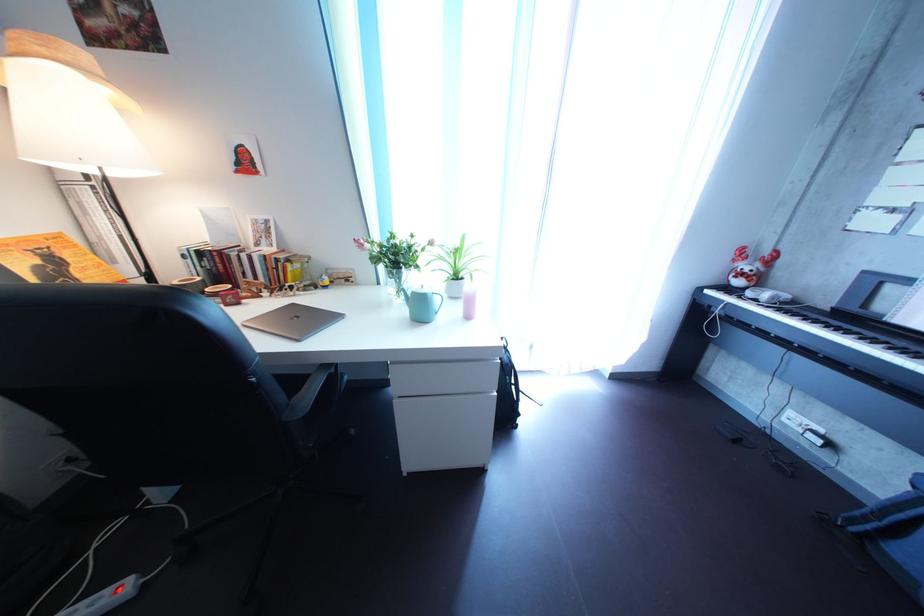
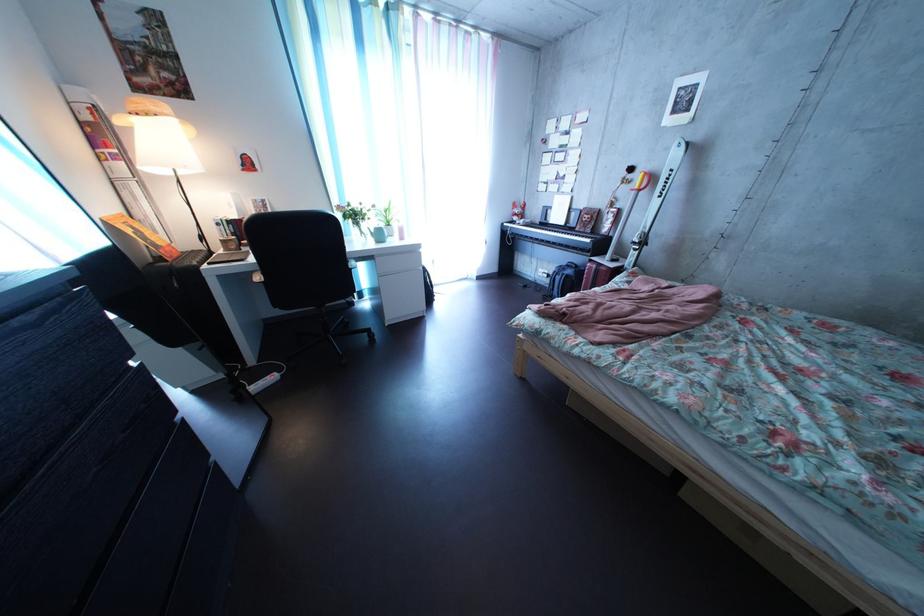
Where in the second image is the point corresponding to point 805,421 from the first image?

(554, 278)